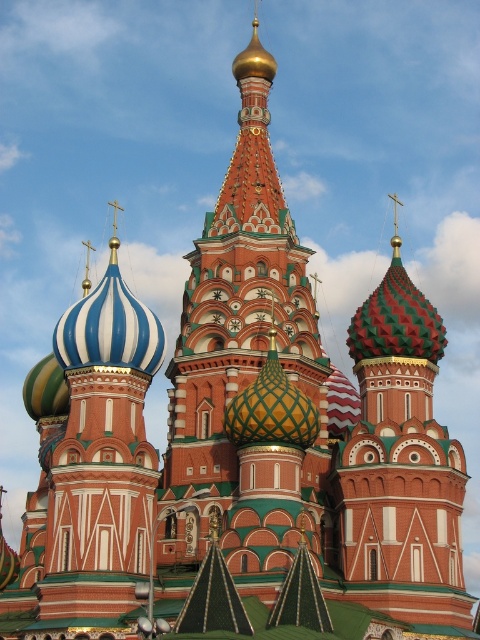
Is red brick onion dome at center thinner than multicolored mosaic dome at center?

Indeed, red brick onion dome at center has a lesser width compared to multicolored mosaic dome at center.

At what (x,y) coordinates should I click in order to perform the action: click on red brick onion dome at center. Please return your answer as a coordinate pair (x, y). The image size is (480, 640). Looking at the image, I should click on (249, 365).

Does red brick onion dome at center appear over blue and white striped dome at center?

Yes, red brick onion dome at center is above blue and white striped dome at center.

Is red brick onion dome at center thinner than blue and white striped dome at center?

Yes.

Is point (228, 189) positioned before point (93, 497)?

That is False.

The height and width of the screenshot is (640, 480). What are the coordinates of `red brick onion dome at center` in the screenshot? It's located at click(249, 365).

Is blue and white striped dome at center below multicolored mosaic dome at center?

Correct, blue and white striped dome at center is located below multicolored mosaic dome at center.

Can you confirm if blue and white striped dome at center is shorter than multicolored mosaic dome at center?

Correct, blue and white striped dome at center is not as tall as multicolored mosaic dome at center.

Does point (123, 449) come farther from viewer compared to point (422, 323)?

That is False.

You are a GUI agent. You are given a task and a screenshot of the screen. Output one action in this format:
    pyautogui.click(x=<x>, y=<y>)
    Task: Click on the blue and white striped dome at center
    The height and width of the screenshot is (640, 480).
    Given the screenshot: What is the action you would take?
    pyautogui.click(x=90, y=465)